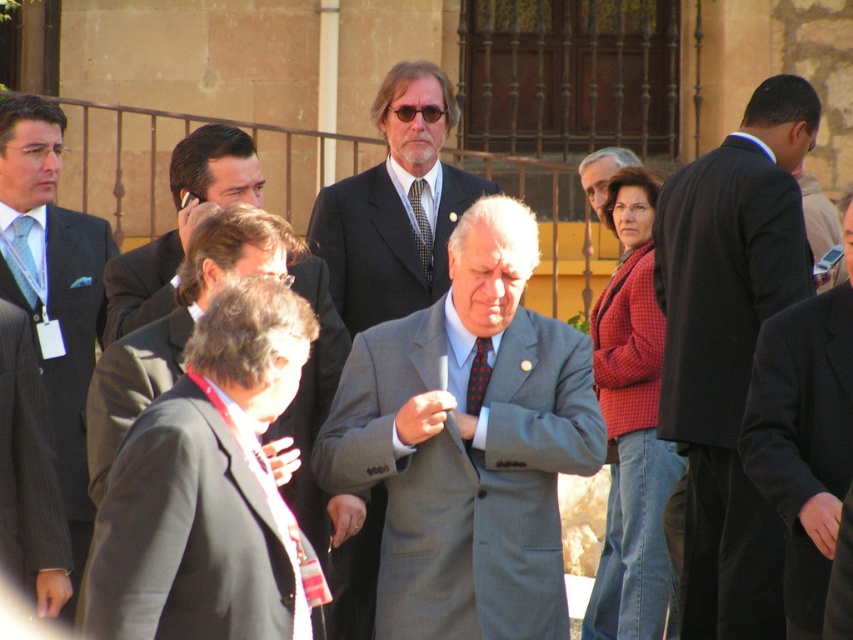
Question: Does dark gray suit at lower left have a smaller size compared to patterned silk tie at center?

Choices:
 (A) no
 (B) yes

Answer: (A)

Question: Observing the image, what is the correct spatial positioning of gray suit at center in reference to matte black suit at center?

Choices:
 (A) right
 (B) left

Answer: (A)

Question: Can you confirm if gray suit at center is thinner than black wool suit at center?

Choices:
 (A) yes
 (B) no

Answer: (A)

Question: Which of the following is the farthest from the observer?

Choices:
 (A) light blue pinstripe suit at left
 (B) dark gray suit at center
 (C) dark gray suit at lower left
 (D) matte blue tie at left

Answer: (D)

Question: Which of the following is the closest to the observer?

Choices:
 (A) (236, 508)
 (B) (6, 364)
 (C) (753, 600)
 (D) (38, 260)

Answer: (A)

Question: Which is farther from the dark gray suit at lower left?

Choices:
 (A) light blue pinstripe suit at left
 (B) dark gray suit at center
 (C) gray pinstripe suit at left

Answer: (B)